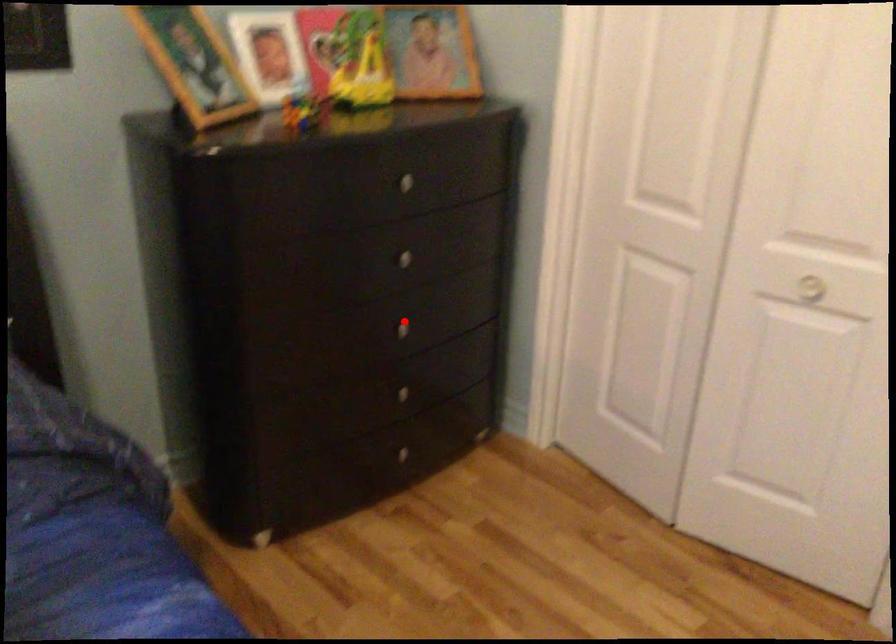
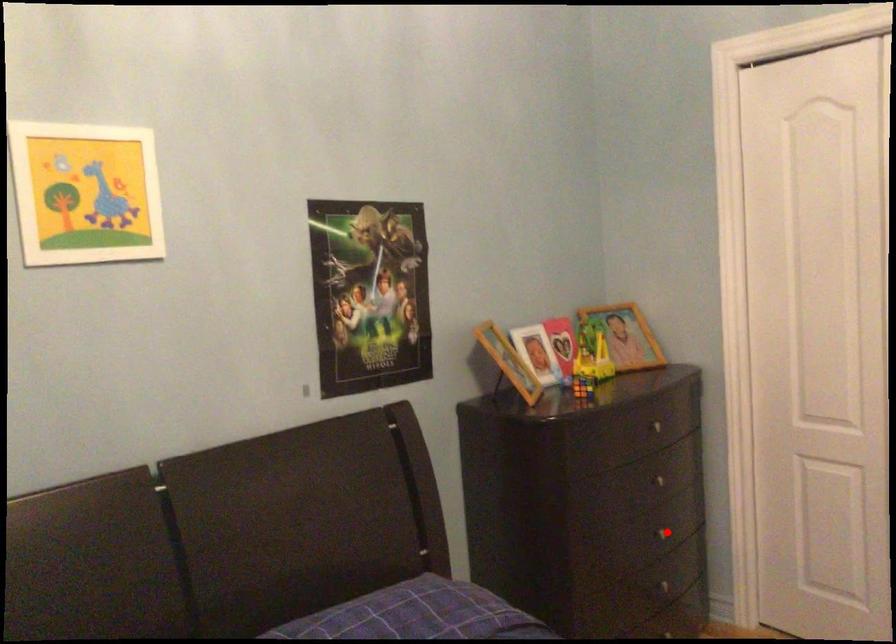
I am providing you with two images of the same scene from different viewpoints. A red point is marked on the first image and another point is marked on the second image. Is the marked point in image1 the same physical position as the marked point in image2?

Yes